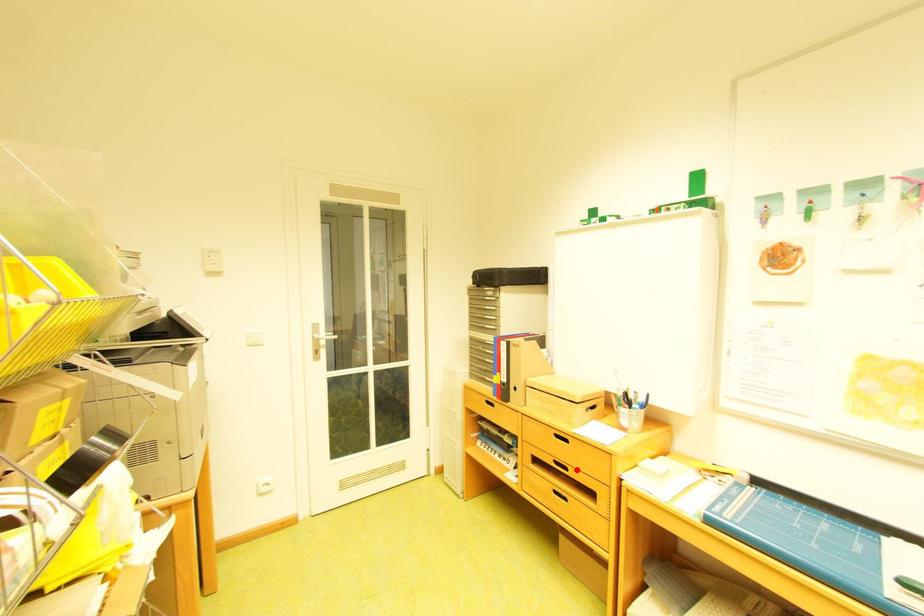
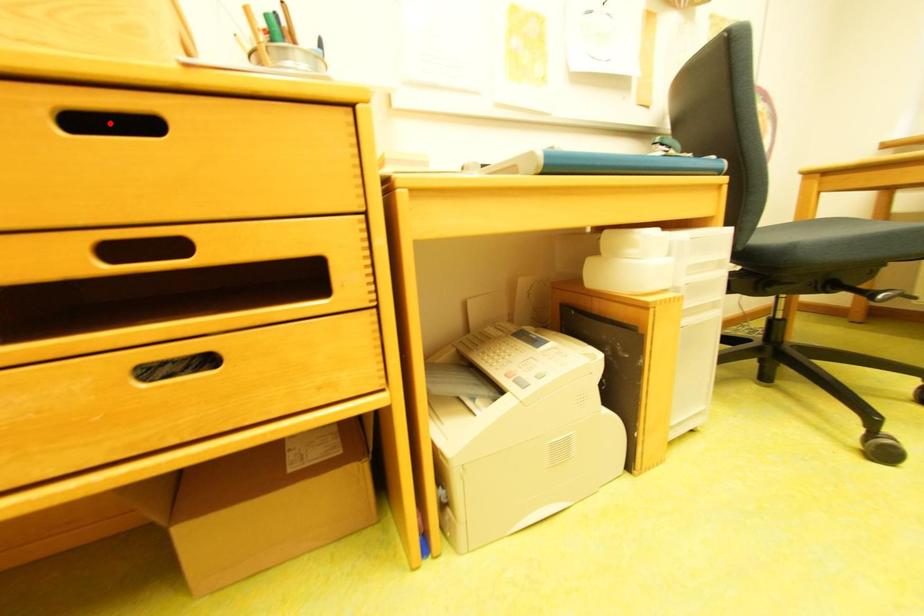
I am providing you with two images of the same scene from different viewpoints. A red point is marked on the first image and another point is marked on the second image. Is the red point in image1 aligned with the point shown in image2?

No